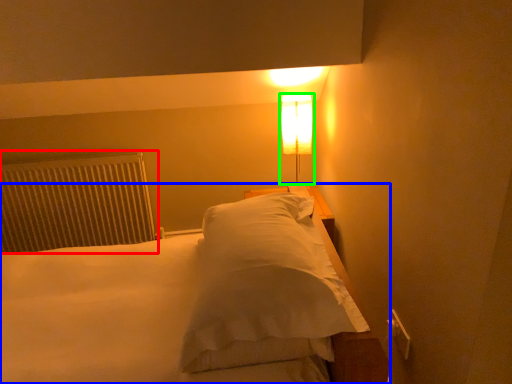
Question: Based on their relative distances, which object is nearer to radiator (highlighted by a red box)? Choose from bed (highlighted by a blue box) and lamp (highlighted by a green box).

Choices:
 (A) bed
 (B) lamp

Answer: (A)